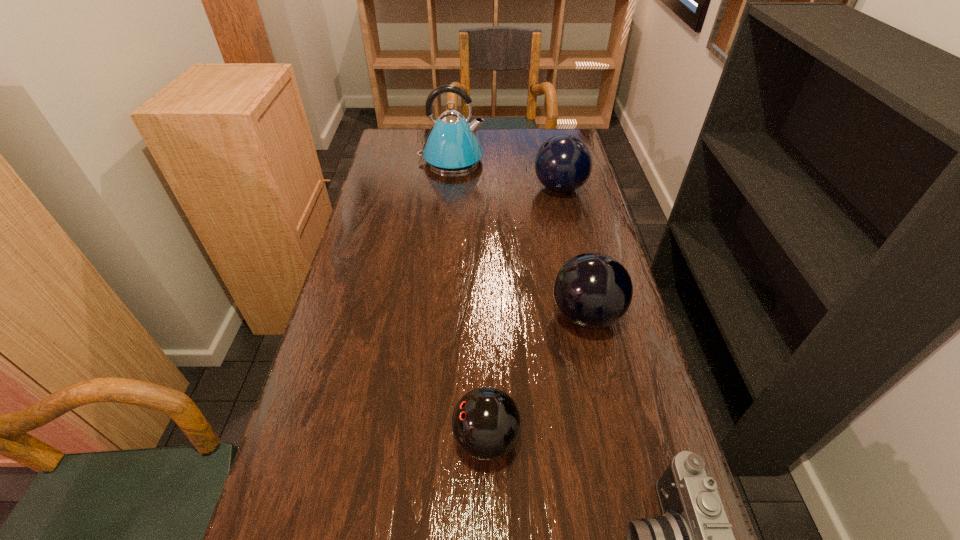
What are the coordinates of `free region at the far left corner of the desktop` in the screenshot? It's located at (410, 137).

Where is `vacant position at the far right corner of the desktop`? The height and width of the screenshot is (540, 960). vacant position at the far right corner of the desktop is located at coordinates (558, 133).

The image size is (960, 540). I want to click on vacant area that lies between the tallest object and the farthest bowling ball, so click(506, 174).

Locate an element on the screen. The image size is (960, 540). free space between the tallest object and the fourth farthest object is located at coordinates (468, 300).

The image size is (960, 540). What are the coordinates of `unoccupied area between the third nearest object and the nearest bowling ball` in the screenshot? It's located at (537, 377).

Locate an element on the screen. Image resolution: width=960 pixels, height=540 pixels. blank region between the kettle and the third farthest object is located at coordinates (518, 238).

The width and height of the screenshot is (960, 540). I want to click on vacant space in between the tallest object and the fourth farthest object, so click(468, 300).

Locate an element on the screen. Image resolution: width=960 pixels, height=540 pixels. free space between the second farthest bowling ball and the farthest bowling ball is located at coordinates (573, 252).

Locate an element on the screen. object identified as the third closest to the tallest object is located at coordinates (486, 423).

Find the location of a particular element. The width and height of the screenshot is (960, 540). object that can be found as the third closest to the farthest bowling ball is located at coordinates (486, 423).